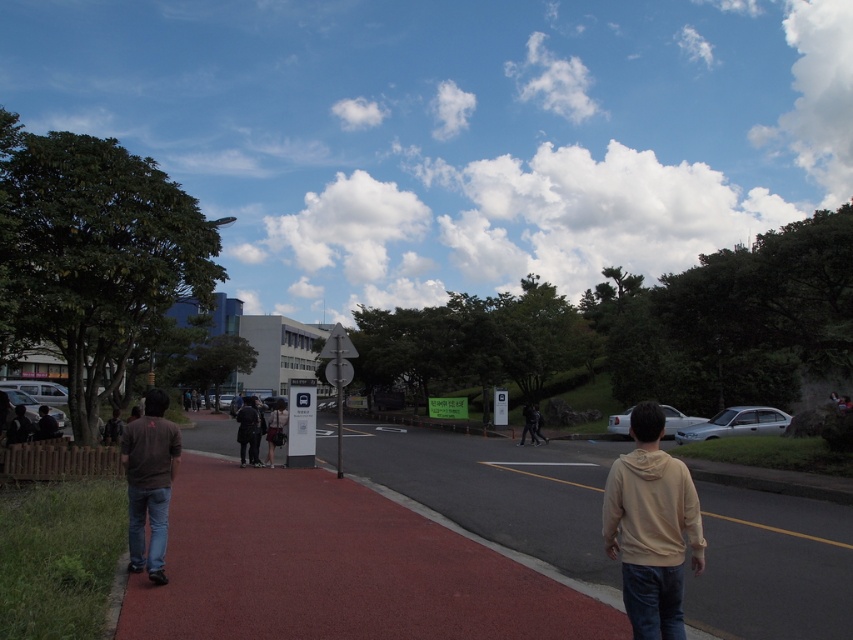
Question: Does red rubber pavement at center lie in front of beige hoodie at center?

Choices:
 (A) yes
 (B) no

Answer: (B)

Question: Considering the real-world distances, which object is closest to the red rubber pavement at center?

Choices:
 (A) dark brown shirt at left
 (B) beige hoodie at center

Answer: (B)

Question: Which is farther from the dark brown shirt at left?

Choices:
 (A) red rubber pavement at center
 (B) beige hoodie at center

Answer: (A)

Question: Which of the following is the farthest from the observer?

Choices:
 (A) (641, 529)
 (B) (148, 456)

Answer: (B)

Question: Can you confirm if beige hoodie at center is smaller than dark brown shirt at left?

Choices:
 (A) no
 (B) yes

Answer: (A)

Question: Is beige hoodie at center to the left of dark brown shirt at left from the viewer's perspective?

Choices:
 (A) yes
 (B) no

Answer: (B)